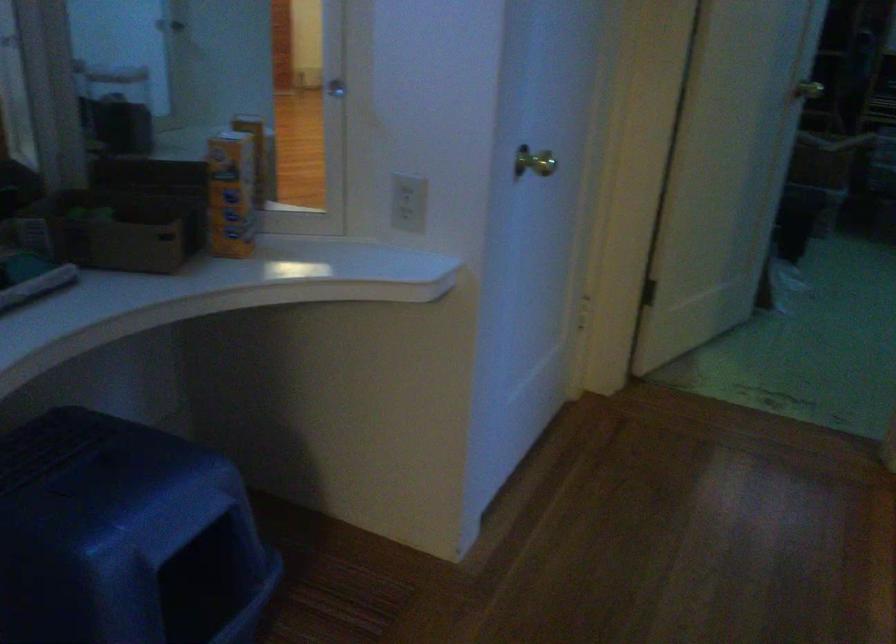
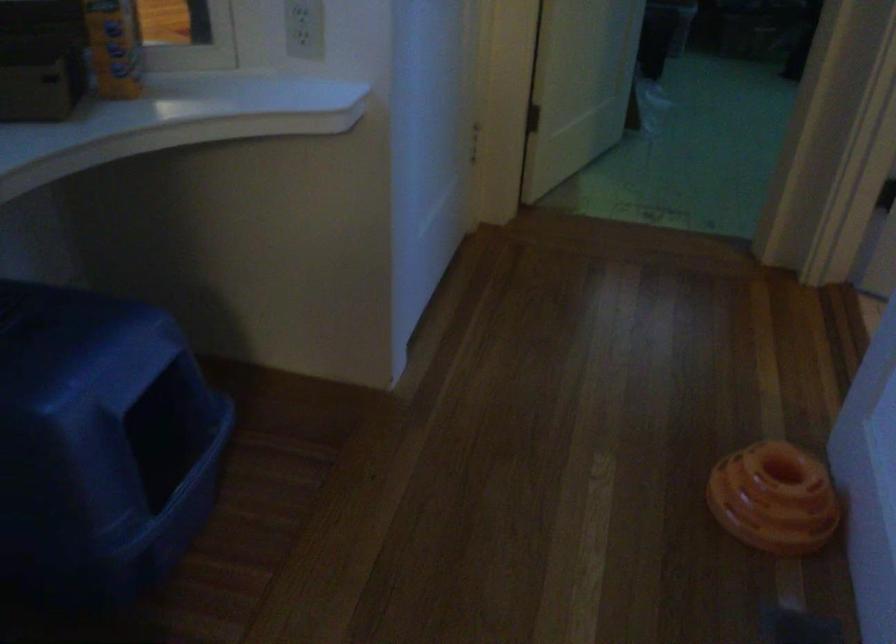
Question: The images are taken continuously from a first-person perspective. In which direction are you moving?

Choices:
 (A) Left
 (B) Right
 (C) Forward
 (D) Backward

Answer: (A)